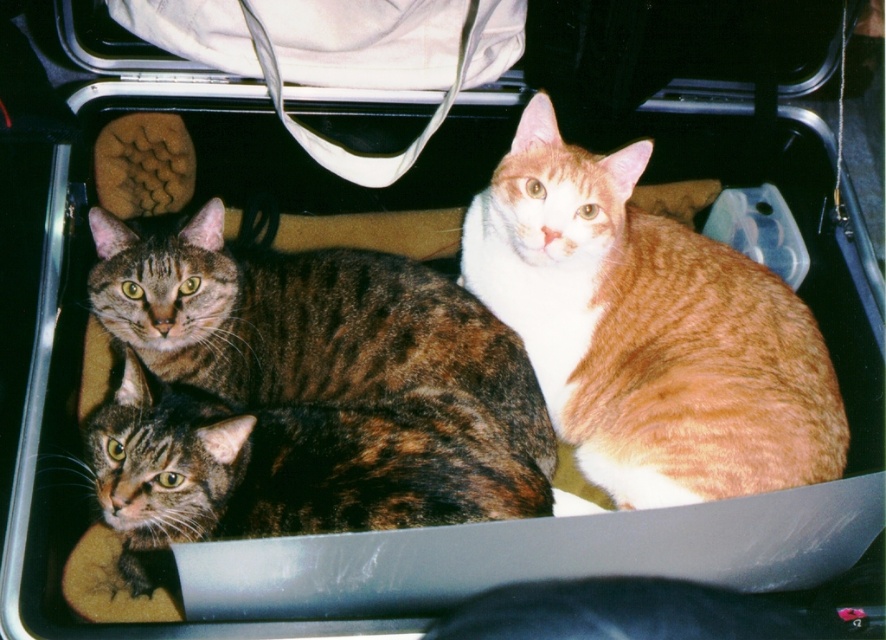
Question: Which is nearer to the dark brown fur cat at center?

Choices:
 (A) orange tabby cat at center
 (B) brown tabby cat at center

Answer: (B)

Question: Is orange tabby cat at center bigger than dark brown fur cat at center?

Choices:
 (A) yes
 (B) no

Answer: (A)

Question: Which point is farther from the camera taking this photo?

Choices:
 (A) [x=473, y=298]
 (B) [x=581, y=298]

Answer: (A)

Question: Is dark brown fur cat at center thinner than brown tabby cat at center?

Choices:
 (A) yes
 (B) no

Answer: (B)

Question: From the image, what is the correct spatial relationship of orange tabby cat at center in relation to brown tabby cat at center?

Choices:
 (A) right
 (B) left

Answer: (A)

Question: Which point is farther to the camera?

Choices:
 (A) dark brown fur cat at center
 (B) orange tabby cat at center

Answer: (A)